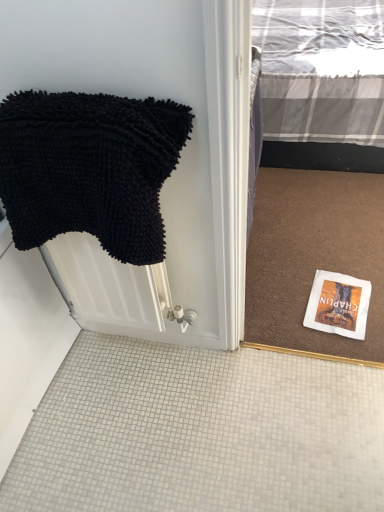
Measure the distance between point (349, 291) and camera.

The depth of point (349, 291) is 5.35 feet.

What do you see at coordinates (338, 304) in the screenshot?
I see `white paper book cover at lower right` at bounding box center [338, 304].

Where is `white paper book cover at lower right`? white paper book cover at lower right is located at coordinates (338, 304).

What is the approximate width of white paper book cover at lower right?

It is 11.78 inches.

You are a GUI agent. You are given a task and a screenshot of the screen. Output one action in this format:
    pyautogui.click(x=<x>, y=<y>)
    Task: Click on the black chenille towel at left
    The width and height of the screenshot is (384, 512).
    Given the screenshot: What is the action you would take?
    pyautogui.click(x=90, y=168)

Measure the distance between point (x=72, y=115) and camera.

Point (x=72, y=115) is 81.90 centimeters away from camera.

This screenshot has height=512, width=384. Describe the element at coordinates (90, 168) in the screenshot. I see `black chenille towel at left` at that location.

Where is `white paper book cover at lower right`? white paper book cover at lower right is located at coordinates (338, 304).

Considering the positions of objects white paper book cover at lower right and black chenille towel at left in the image provided, who is more to the right, white paper book cover at lower right or black chenille towel at left?

From the viewer's perspective, white paper book cover at lower right appears more on the right side.

Relative to black chenille towel at left, is white paper book cover at lower right in front or behind?

In the image, white paper book cover at lower right appears behind black chenille towel at left.

Does point (355, 293) come farther from viewer compared to point (34, 139)?

Yes.

From the image's perspective, is white paper book cover at lower right below black chenille towel at left?

Yes, from the image's perspective, white paper book cover at lower right is below black chenille towel at left.

From a real-world perspective, is white paper book cover at lower right positioned over black chenille towel at left based on gravity?

No, from a real-world perspective, white paper book cover at lower right is not above black chenille towel at left.

Can you confirm if white paper book cover at lower right is thinner than black chenille towel at left?

No.

Is white paper book cover at lower right taller or shorter than black chenille towel at left?

Considering their sizes, white paper book cover at lower right has less height than black chenille towel at left.

From the picture: Considering the sizes of objects white paper book cover at lower right and black chenille towel at left in the image provided, who is smaller, white paper book cover at lower right or black chenille towel at left?

With smaller size is white paper book cover at lower right.

Is black chenille towel at left inside white paper book cover at lower right?

Definitely not — black chenille towel at left is not inside white paper book cover at lower right.

Is white paper book cover at lower right placed right next to black chenille towel at left?

No, white paper book cover at lower right is not touching black chenille towel at left.

Is white paper book cover at lower right turned away from black chenille towel at left?

No, black chenille towel at left is not at the back of white paper book cover at lower right.

Locate an element on the screen. Image resolution: width=384 pixels, height=512 pixels. towel in front of the white paper book cover at lower right is located at coordinates (90, 168).

Which object is positioned more to the right, black chenille towel at left or white paper book cover at lower right?

From the viewer's perspective, white paper book cover at lower right appears more on the right side.

Which is in front, black chenille towel at left or white paper book cover at lower right?

black chenille towel at left is more forward.

Which is in front, point (9, 147) or point (333, 305)?

The point (9, 147) is in front.

Based on the photo, from the image's perspective, is black chenille towel at left positioned above or below white paper book cover at lower right?

Based on their image positions, black chenille towel at left is located above white paper book cover at lower right.

From a real-world perspective, who is located higher, black chenille towel at left or white paper book cover at lower right?

black chenille towel at left.

Considering the sizes of black chenille towel at left and white paper book cover at lower right in the image, is black chenille towel at left wider or thinner than white paper book cover at lower right?

In the image, black chenille towel at left appears to be more narrow than white paper book cover at lower right.

Does black chenille towel at left have a greater height compared to white paper book cover at lower right?

Yes, black chenille towel at left is taller than white paper book cover at lower right.

Does black chenille towel at left have a smaller size compared to white paper book cover at lower right?

No, black chenille towel at left is not smaller than white paper book cover at lower right.

Choose the correct answer: Is black chenille towel at left inside white paper book cover at lower right or outside it?

black chenille towel at left cannot be found inside white paper book cover at lower right.

From the picture: Would you consider black chenille towel at left to be distant from white paper book cover at lower right?

That's not correct — black chenille towel at left is a little close to white paper book cover at lower right.

Is black chenille towel at left oriented towards white paper book cover at lower right?

No.

Locate an element on the screen. towel lying in front of the white paper book cover at lower right is located at coordinates (90, 168).

The height and width of the screenshot is (512, 384). I want to click on towel located above the white paper book cover at lower right (from the image's perspective), so click(x=90, y=168).

Locate an element on the screen. This screenshot has width=384, height=512. towel in front of the white paper book cover at lower right is located at coordinates (90, 168).